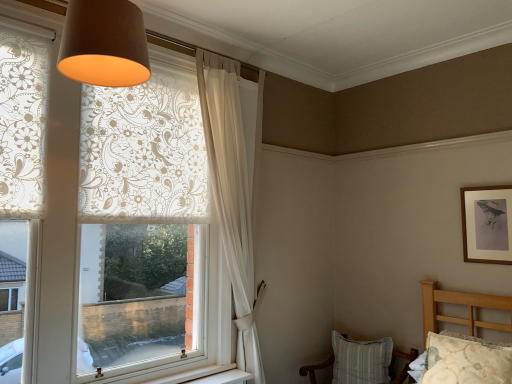
Question: In the image, is floral fabric pillow at lower right positioned in front of or behind brown fabric lampshade at upper center?

Choices:
 (A) behind
 (B) front

Answer: (A)

Question: From their relative heights in the image, would you say floral fabric pillow at lower right is taller or shorter than brown fabric lampshade at upper center?

Choices:
 (A) short
 (B) tall

Answer: (A)

Question: Considering the real-world distances, which object is closest to the white sheer curtain at upper center?

Choices:
 (A) brown fabric lampshade at upper center
 (B) striped fabric chair at lower right
 (C) wooden framed print at upper right
 (D) white lace curtain at left
 (E) floral fabric pillow at lower right

Answer: (D)

Question: Which object is the farthest from the floral fabric pillow at lower right?

Choices:
 (A) white sheer curtain at upper center
 (B) brown fabric lampshade at upper center
 (C) white lace curtain at left
 (D) wooden framed print at upper right
 (E) striped fabric chair at lower right

Answer: (B)